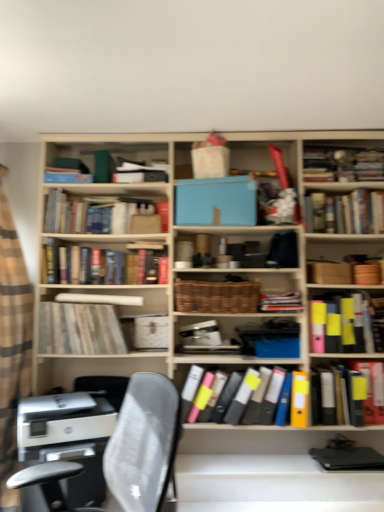
What do you see at coordinates (370, 388) in the screenshot? I see `matte black folder at right, arranged as the 2th book when ordered from the bottom` at bounding box center [370, 388].

What do you see at coordinates (79, 329) in the screenshot? I see `white paper at center, positioned as the sixth book in top-to-bottom order` at bounding box center [79, 329].

Find the location of a particular element. woven brown basket at center is located at coordinates (216, 296).

You are a GUI agent. You are given a task and a screenshot of the screen. Output one action in this format:
    pyautogui.click(x=<x>, y=<y>)
    Task: Click on the multicolored file folders at center, positioned as the first book in bottom-to-top order
    This screenshot has width=384, height=512.
    Given the screenshot: What is the action you would take?
    pyautogui.click(x=255, y=396)

In the scene shown: Measure the distance between gray fabric chair at center and camera.

They are 4.02 feet apart.

This screenshot has height=512, width=384. Describe the element at coordinates (144, 443) in the screenshot. I see `gray fabric chair at center` at that location.

The image size is (384, 512). Find the location of `blue matte book at center`. blue matte book at center is located at coordinates (216, 201).

From the picture: Which object is closer to the camera taking this photo, white paper at center, which ranks as the third book in bottom-to-top order, or matte black book at center, placed as the fifth book when sorted from bottom to top?

matte black book at center, placed as the fifth book when sorted from bottom to top, is closer to the camera.

Is matte black book at center, which is the fourth book from top to bottom, inside white paper at center, positioned as the sixth book in top-to-bottom order?

No, matte black book at center, which is the fourth book from top to bottom, is not inside white paper at center, positioned as the sixth book in top-to-bottom order.

From a real-world perspective, is white paper at center, positioned as the sixth book in top-to-bottom order, on matte black book at center, which is the fourth book from top to bottom?

No.

Where is `book that is the 1st object directly below the matte black book at center, placed as the fifth book when sorted from bottom to top (from a real-world perspective)`? The height and width of the screenshot is (512, 384). book that is the 1st object directly below the matte black book at center, placed as the fifth book when sorted from bottom to top (from a real-world perspective) is located at coordinates (355, 320).

Could you tell me if matte black book at center, which is the fourth book from top to bottom, is facing matte yellow folder at right, the fifth book in the top-to-bottom sequence?

No, matte black book at center, which is the fourth book from top to bottom, is not oriented towards matte yellow folder at right, the fifth book in the top-to-bottom sequence.

From a real-world perspective, which is physically above, matte black book at center, which is the fourth book from top to bottom, or matte yellow folder at right, positioned as the fourth book in bottom-to-top order?

matte black book at center, which is the fourth book from top to bottom.

Between matte black book at center, which is the fourth book from top to bottom, and matte yellow folder at right, the fifth book in the top-to-bottom sequence, which one appears on the left side from the viewer's perspective?

matte black book at center, which is the fourth book from top to bottom, is more to the left.

Considering the sizes of objects hardcover books at upper left, placed as the 1th book when sorted from top to bottom, and woven brown basket at center in the image provided, who is bigger, hardcover books at upper left, placed as the 1th book when sorted from top to bottom, or woven brown basket at center?

With larger size is hardcover books at upper left, placed as the 1th book when sorted from top to bottom.

Image resolution: width=384 pixels, height=512 pixels. I want to click on shelf on the right of hardcover books at upper left, the eighth book in the bottom-to-top sequence, so click(x=216, y=296).

Does point (153, 209) appear closer or farther from the camera than point (255, 307)?

Point (153, 209).

From the image's perspective, between hardcover book at upper right, which is the seventh book from bottom to top, and matte yellow folder at right, positioned as the fourth book in bottom-to-top order, which one is located above?

From the image's view, hardcover book at upper right, which is the seventh book from bottom to top, is above.

Is hardcover book at upper right, which appears as the 2th book when viewed from the top, at the right side of matte yellow folder at right, the fifth book in the top-to-bottom sequence?

Yes.

Is hardcover book at upper right, which appears as the 2th book when viewed from the top, thinner than matte yellow folder at right, the fifth book in the top-to-bottom sequence?

Yes.

Can you tell me how much hardcover book at upper right, which appears as the 2th book when viewed from the top, and matte yellow folder at right, positioned as the fourth book in bottom-to-top order, differ in facing direction?

There is a 0.00124-degree angle between the facing directions of hardcover book at upper right, which appears as the 2th book when viewed from the top, and matte yellow folder at right, positioned as the fourth book in bottom-to-top order.

Can you tell me how much matte black folder at right, which is the 7th book from top to bottom, and matte black book at center, placed as the fifth book when sorted from bottom to top, differ in facing direction?

They differ by 0.00587 degrees in their facing directions.

Is matte black folder at right, arranged as the 2th book when ordered from the bottom, positioned with its back to matte black book at center, placed as the fifth book when sorted from bottom to top?

No, matte black book at center, placed as the fifth book when sorted from bottom to top, is not at the back of matte black folder at right, arranged as the 2th book when ordered from the bottom.

From the image's perspective, is matte black folder at right, arranged as the 2th book when ordered from the bottom, located above or below matte black book at center, placed as the fifth book when sorted from bottom to top?

matte black folder at right, arranged as the 2th book when ordered from the bottom, is below matte black book at center, placed as the fifth book when sorted from bottom to top.

Is matte black folder at right, which is the 7th book from top to bottom, to the left of matte black book at center, placed as the fifth book when sorted from bottom to top, from the viewer's perspective?

No.

I want to click on shelf above the matte black folder at right, arranged as the 2th book when ordered from the bottom (from a real-world perspective), so point(216,296).

Does point (378, 367) appear closer or farther from the camera than point (218, 306)?

Clearly, point (378, 367) is more distant from the camera than point (218, 306).

Are matte black folder at right, which is the 7th book from top to bottom, and woven brown basket at center located far from each other?

No, there isn't a large distance between matte black folder at right, which is the 7th book from top to bottom, and woven brown basket at center.

In the scene shown: Is matte black folder at right, arranged as the 2th book when ordered from the bottom, not within woven brown basket at center?

Absolutely, matte black folder at right, arranged as the 2th book when ordered from the bottom, is external to woven brown basket at center.

Is white paper at center, which ranks as the third book in bottom-to-top order, not close to multicolored file folders at center, the eighth book in the top-to-bottom sequence?

Actually, white paper at center, which ranks as the third book in bottom-to-top order, and multicolored file folders at center, the eighth book in the top-to-bottom sequence, are a little close together.

Can you confirm if white paper at center, which ranks as the third book in bottom-to-top order, is smaller than multicolored file folders at center, positioned as the first book in bottom-to-top order?

Yes.

Who is more distant, white paper at center, which ranks as the third book in bottom-to-top order, or multicolored file folders at center, the eighth book in the top-to-bottom sequence?

white paper at center, which ranks as the third book in bottom-to-top order, is further from the camera.

How different are the orientations of white paper at center, positioned as the sixth book in top-to-bottom order, and multicolored file folders at center, positioned as the first book in bottom-to-top order, in degrees?

1.74 degrees separate the facing orientations of white paper at center, positioned as the sixth book in top-to-bottom order, and multicolored file folders at center, positioned as the first book in bottom-to-top order.

There is a white paper at center, which ranks as the third book in bottom-to-top order. At what (x,y) coordinates should I click in order to perform the action: click on the 2nd book above it (from a real-world perspective). Please return your answer as a coordinate pair (x, y). Looking at the image, I should click on (280, 301).

You are a GUI agent. You are given a task and a screenshot of the screen. Output one action in this format:
    pyautogui.click(x=<x>, y=<y>)
    Task: Click on the 1st book counting from the left of the matte yellow folder at right, positioned as the fourth book in bottom-to-top order
    This screenshot has height=512, width=384.
    Given the screenshot: What is the action you would take?
    pyautogui.click(x=280, y=301)

Estimate the real-world distances between objects in this image. Which object is closer to multicolored file folders at center, the eighth book in the top-to-bottom sequence, blue matte book at center or hardcover books at center, which is the 3th book from top to bottom?

hardcover books at center, which is the 3th book from top to bottom.

In the scene shown: From the image, which object appears to be nearer to matte black book at center, placed as the fifth book when sorted from bottom to top, white paper at center, positioned as the sixth book in top-to-bottom order, or hardcover book at upper right, which appears as the 2th book when viewed from the top?

Among the two, hardcover book at upper right, which appears as the 2th book when viewed from the top, is located nearer to matte black book at center, placed as the fifth book when sorted from bottom to top.

Looking at the image, which one is located further to matte black book at center, which is the fourth book from top to bottom, hardcover books at center, which is the 3th book from top to bottom, or multicolored file folders at center, positioned as the first book in bottom-to-top order?

hardcover books at center, which is the 3th book from top to bottom, is further to matte black book at center, which is the fourth book from top to bottom.

Which object lies nearer to the anchor point matte black book at center, placed as the fifth book when sorted from bottom to top, hardcover books at upper left, placed as the 1th book when sorted from top to bottom, or hardcover books at center, which is the 3th book from top to bottom?

hardcover books at center, which is the 3th book from top to bottom, is closer to matte black book at center, placed as the fifth book when sorted from bottom to top.

When comparing their distances from hardcover book at upper right, which is the seventh book from bottom to top, does hardcover books at center, which is the 3th book from top to bottom, or woven brown basket at center seem further?

hardcover books at center, which is the 3th book from top to bottom, is further to hardcover book at upper right, which is the seventh book from bottom to top.

From the image, which object appears to be nearer to matte yellow folder at right, positioned as the fourth book in bottom-to-top order, matte black book at center, which is the fourth book from top to bottom, or multicolored file folders at center, positioned as the first book in bottom-to-top order?

matte black book at center, which is the fourth book from top to bottom, lies closer to matte yellow folder at right, positioned as the fourth book in bottom-to-top order, than the other object.

Which object lies nearer to the anchor point hardcover books at upper left, the eighth book in the bottom-to-top sequence, multicolored file folders at center, positioned as the first book in bottom-to-top order, or hardcover book at upper right, which appears as the 2th book when viewed from the top?

multicolored file folders at center, positioned as the first book in bottom-to-top order, is closer to hardcover books at upper left, the eighth book in the bottom-to-top sequence.

Looking at the image, which one is located further to woven brown basket at center, hardcover book at upper right, which appears as the 2th book when viewed from the top, or hardcover books at upper left, the eighth book in the bottom-to-top sequence?

hardcover book at upper right, which appears as the 2th book when viewed from the top, is positioned further to the anchor woven brown basket at center.

Where is `paperback book between white paper at center, which ranks as the third book in bottom-to-top order, and matte black folder at right, arranged as the 2th book when ordered from the bottom, in the horizontal direction`? This screenshot has width=384, height=512. paperback book between white paper at center, which ranks as the third book in bottom-to-top order, and matte black folder at right, arranged as the 2th book when ordered from the bottom, in the horizontal direction is located at coordinates (216, 201).

The image size is (384, 512). I want to click on book between hardcover books at upper left, placed as the 1th book when sorted from top to bottom, and blue matte book at center from left to right, so click(x=107, y=264).

Find the location of a particular element. This screenshot has height=512, width=384. shelf positioned between gray fabric chair at center and hardcover books at upper left, the eighth book in the bottom-to-top sequence, from near to far is located at coordinates (216, 296).

Locate an element on the screen. This screenshot has width=384, height=512. shelf located between hardcover books at upper left, placed as the 1th book when sorted from top to bottom, and matte black folder at right, arranged as the 2th book when ordered from the bottom, in the left-right direction is located at coordinates (216, 296).